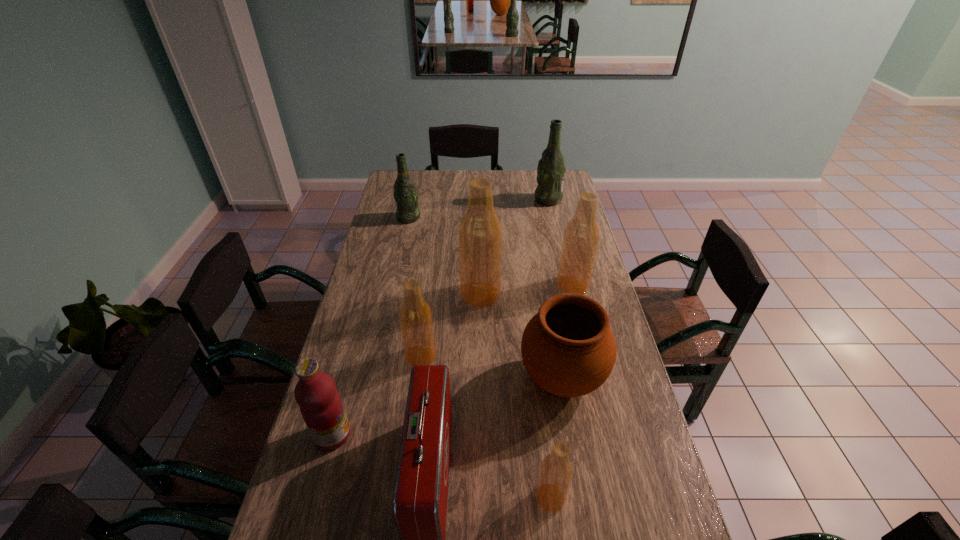
Find the location of a particular element. the tallest beer bottle is located at coordinates (480, 232).

Locate an element on the screen. Image resolution: width=960 pixels, height=540 pixels. the third tan beer bottle from right to left is located at coordinates (480, 232).

What are the coordinates of `the farther green beer bottle` in the screenshot? It's located at (551, 169).

This screenshot has height=540, width=960. Identify the location of the right green beer bottle. (551, 169).

Where is `the rightmost tan beer bottle`? This screenshot has height=540, width=960. the rightmost tan beer bottle is located at coordinates (581, 238).

Where is `the left green beer bottle`? The image size is (960, 540). the left green beer bottle is located at coordinates (405, 194).

Find the location of `the second farthest beer bottle`. the second farthest beer bottle is located at coordinates (405, 194).

Identify the location of the fifth farthest beer bottle. (415, 315).

The width and height of the screenshot is (960, 540). Find the location of `the second nearest tan beer bottle`. the second nearest tan beer bottle is located at coordinates (415, 315).

This screenshot has height=540, width=960. I want to click on pink fruit juice, so click(x=321, y=407).